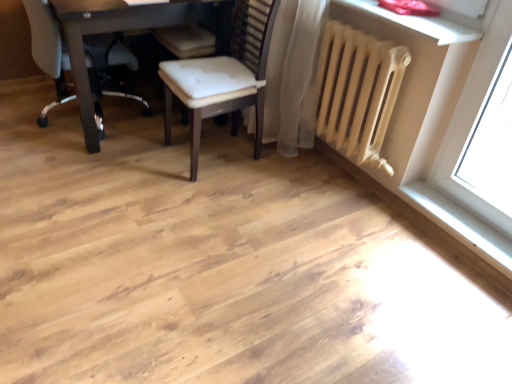
The image size is (512, 384). I want to click on wooden chair at center, the 1th chair in the right-to-left sequence, so click(x=223, y=72).

The width and height of the screenshot is (512, 384). I want to click on white leather chair at upper left, acting as the 2th chair starting from the right, so click(49, 50).

What are the coordinates of `matte dark brown table at upper left` in the screenshot? It's located at (123, 31).

You are a GUI agent. You are given a task and a screenshot of the screen. Output one action in this format:
    pyautogui.click(x=<x>, y=<y>)
    Task: Click on the beige matte radiator at upper right
    The width and height of the screenshot is (512, 384).
    Given the screenshot: What is the action you would take?
    pyautogui.click(x=358, y=91)

Does beige matte radiator at upper right come in front of wooden chair at center, the 1th chair in the right-to-left sequence?

Yes, beige matte radiator at upper right is closer to the camera.

From the image's perspective, relative to wooden chair at center, the 1th chair in the right-to-left sequence, is beige matte radiator at upper right above or below?

Clearly, from the image's perspective, beige matte radiator at upper right is below wooden chair at center, the 1th chair in the right-to-left sequence.

Which is less distant, (404, 61) or (249, 97)?

Point (404, 61) is closer to the camera than point (249, 97).

From a real-world perspective, which is physically above, wooden chair at center, the 1th chair in the right-to-left sequence, or matte dark brown table at upper left?

wooden chair at center, the 1th chair in the right-to-left sequence.

In the scene shown: Is wooden chair at center, which is the 2th chair in left-to-right order, wider than matte dark brown table at upper left?

No, wooden chair at center, which is the 2th chair in left-to-right order, is not wider than matte dark brown table at upper left.

Is wooden chair at center, the 1th chair in the right-to-left sequence, beside beige matte radiator at upper right?

wooden chair at center, the 1th chair in the right-to-left sequence, and beige matte radiator at upper right are not in contact.

Is wooden chair at center, the 1th chair in the right-to-left sequence, at the right side of beige matte radiator at upper right?

Incorrect, wooden chair at center, the 1th chair in the right-to-left sequence, is not on the right side of beige matte radiator at upper right.

Which of these two, wooden chair at center, the 1th chair in the right-to-left sequence, or beige matte radiator at upper right, stands taller?

wooden chair at center, the 1th chair in the right-to-left sequence, is taller.

In terms of size, does white leather chair at upper left, acting as the 2th chair starting from the right, appear bigger or smaller than matte dark brown table at upper left?

Clearly, white leather chair at upper left, acting as the 2th chair starting from the right, is smaller in size than matte dark brown table at upper left.

Is the position of white leather chair at upper left, the 1th chair in the left-to-right sequence, more distant than that of matte dark brown table at upper left?

Yes, white leather chair at upper left, the 1th chair in the left-to-right sequence, is further from the viewer.

Is matte dark brown table at upper left located within white leather chair at upper left, acting as the 2th chair starting from the right?

Yes, matte dark brown table at upper left is surrounded by white leather chair at upper left, acting as the 2th chair starting from the right.

Is beige matte radiator at upper right not within white leather chair at upper left, the 1th chair in the left-to-right sequence?

Yes, beige matte radiator at upper right is located beyond the bounds of white leather chair at upper left, the 1th chair in the left-to-right sequence.

Is there a large distance between beige matte radiator at upper right and white leather chair at upper left, acting as the 2th chair starting from the right?

Absolutely, beige matte radiator at upper right is distant from white leather chair at upper left, acting as the 2th chair starting from the right.

Can you confirm if beige matte radiator at upper right is shorter than white leather chair at upper left, the 1th chair in the left-to-right sequence?

Correct, beige matte radiator at upper right is not as tall as white leather chair at upper left, the 1th chair in the left-to-right sequence.

From the image's perspective, is beige matte radiator at upper right over white leather chair at upper left, the 1th chair in the left-to-right sequence?

No, from the image's perspective, beige matte radiator at upper right is not over white leather chair at upper left, the 1th chair in the left-to-right sequence.

Is beige matte radiator at upper right wider than white smooth window sill at lower right?

In fact, beige matte radiator at upper right might be narrower than white smooth window sill at lower right.

Considering the points (326, 97) and (480, 236), which point is behind, point (326, 97) or point (480, 236)?

The point (326, 97) is more distant.

Do you think beige matte radiator at upper right is within white smooth window sill at lower right, or outside of it?

beige matte radiator at upper right lies outside white smooth window sill at lower right.

From the image's perspective, is beige matte radiator at upper right above white smooth window sill at lower right?

Yes, from the image's perspective, beige matte radiator at upper right is over white smooth window sill at lower right.

Can you tell me how much wooden chair at center, the 1th chair in the right-to-left sequence, and white smooth window sill at lower right differ in facing direction?

The facing directions of wooden chair at center, the 1th chair in the right-to-left sequence, and white smooth window sill at lower right are 1.36 degrees apart.

Is wooden chair at center, which is the 2th chair in left-to-right order, oriented towards white smooth window sill at lower right?

No.

Is wooden chair at center, the 1th chair in the right-to-left sequence, in front of white smooth window sill at lower right?

Yes, it is.

From the image's perspective, is wooden chair at center, the 1th chair in the right-to-left sequence, below white smooth window sill at lower right?

No, from the image's perspective, wooden chair at center, the 1th chair in the right-to-left sequence, is not below white smooth window sill at lower right.

The height and width of the screenshot is (384, 512). Find the location of `the 1st chair above the beige matte radiator at upper right (from the image's perspective)`. the 1st chair above the beige matte radiator at upper right (from the image's perspective) is located at coordinates (223, 72).

Identify the location of chair in front of the matte dark brown table at upper left. (223, 72).

Based on their spatial positions, is white leather chair at upper left, acting as the 2th chair starting from the right, or wooden chair at center, the 1th chair in the right-to-left sequence, further from matte dark brown table at upper left?

wooden chair at center, the 1th chair in the right-to-left sequence, is further to matte dark brown table at upper left.

When comparing their distances from beige matte radiator at upper right, does white smooth window sill at lower right or wooden chair at center, which is the 2th chair in left-to-right order, seem further?

The object further to beige matte radiator at upper right is white smooth window sill at lower right.

When comparing their distances from white leather chair at upper left, the 1th chair in the left-to-right sequence, does white smooth window sill at lower right or matte dark brown table at upper left seem closer?

matte dark brown table at upper left.

Estimate the real-world distances between objects in this image. Which object is further from beige matte radiator at upper right, white smooth window sill at lower right or white leather chair at upper left, the 1th chair in the left-to-right sequence?

white leather chair at upper left, the 1th chair in the left-to-right sequence.

Looking at this image, looking at the image, which one is located closer to wooden chair at center, the 1th chair in the right-to-left sequence, matte dark brown table at upper left or white leather chair at upper left, the 1th chair in the left-to-right sequence?

Based on the image, matte dark brown table at upper left appears to be nearer to wooden chair at center, the 1th chair in the right-to-left sequence.

Based on their spatial positions, is wooden chair at center, the 1th chair in the right-to-left sequence, or white leather chair at upper left, acting as the 2th chair starting from the right, further from white smooth window sill at lower right?

white leather chair at upper left, acting as the 2th chair starting from the right, is positioned further to the anchor white smooth window sill at lower right.

Consider the image. Based on their spatial positions, is wooden chair at center, the 1th chair in the right-to-left sequence, or beige matte radiator at upper right closer to white smooth window sill at lower right?

beige matte radiator at upper right is positioned closer to the anchor white smooth window sill at lower right.

Estimate the real-world distances between objects in this image. Which object is further from white leather chair at upper left, acting as the 2th chair starting from the right, matte dark brown table at upper left or white smooth window sill at lower right?

white smooth window sill at lower right is positioned further to the anchor white leather chair at upper left, acting as the 2th chair starting from the right.

Locate an element on the screen. table between white leather chair at upper left, acting as the 2th chair starting from the right, and wooden chair at center, which is the 2th chair in left-to-right order is located at coordinates (123, 31).

The width and height of the screenshot is (512, 384). I want to click on table between white leather chair at upper left, the 1th chair in the left-to-right sequence, and beige matte radiator at upper right, in the horizontal direction, so 123,31.

Locate an element on the screen. chair between matte dark brown table at upper left and white smooth window sill at lower right in the horizontal direction is located at coordinates (223, 72).

At what (x,y) coordinates should I click in order to perform the action: click on radiator situated between wooden chair at center, which is the 2th chair in left-to-right order, and white smooth window sill at lower right from left to right. Please return your answer as a coordinate pair (x, y). Looking at the image, I should click on (358, 91).